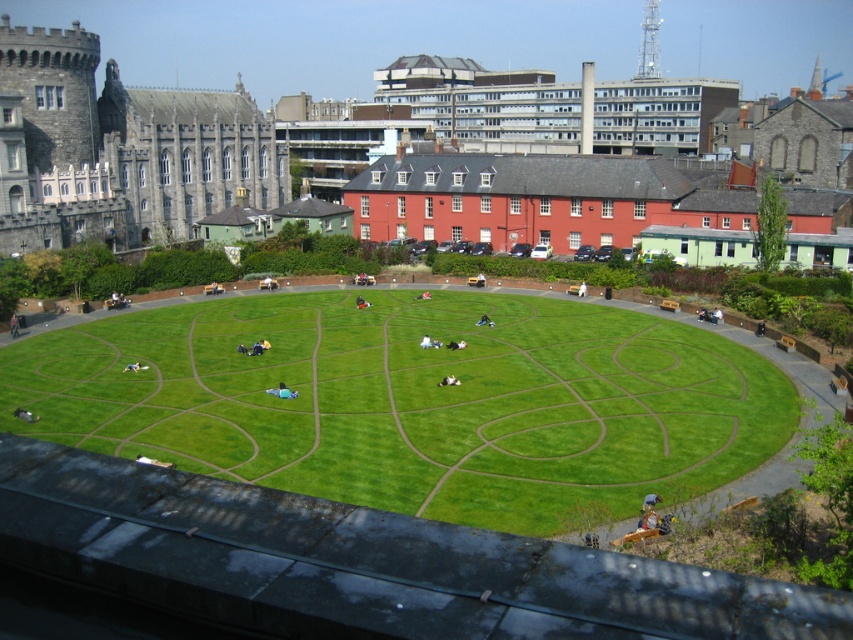
You are a park visitor who wants to place a picnic blanket between the green grass at center and the light blue fabric at center. Since the distance between them is 19.43 meters, will you have enough space to set up your picnic blanket comfortably?

The green grass at center and light blue fabric at center are 19.43 meters apart from each other, so yes, there is sufficient space to place a picnic blanket between them comfortably.

You are a photographer standing at the edge of the park and want to capture both the green grass at center and the light blue fabric at center in the same frame. Based on their positions, which object should you adjust your camera to focus on first to ensure both are in the shot?

The green grass at center is positioned on the left side of light blue fabric at center. To capture both in the same frame, focus on the light blue fabric at center first since it is on the right, allowing the green grass at center to naturally fall into the left side of the frame.